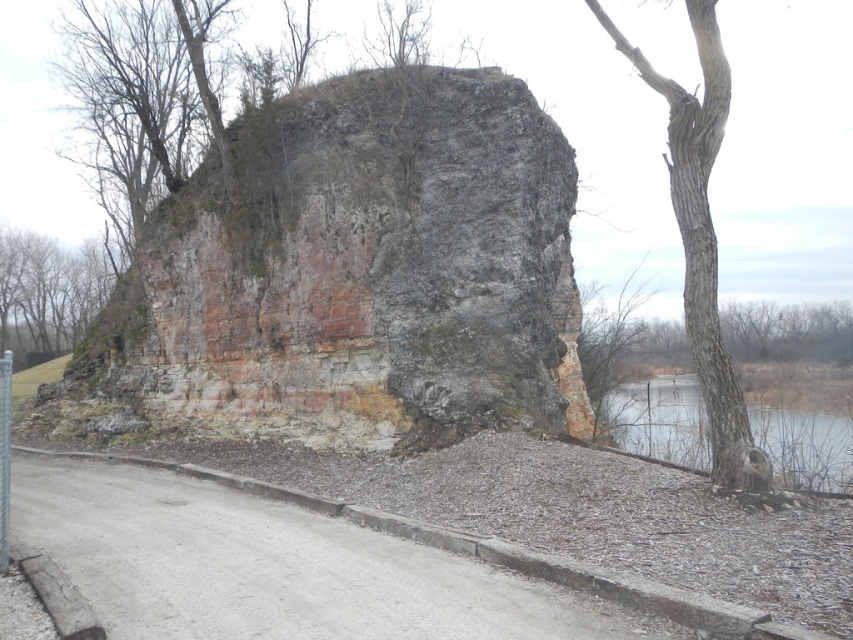
Does point (161, 244) lie in front of point (625, 339)?

That is True.

Does rusty stone cliff at center have a greater width compared to bare branches at right?

Correct, the width of rusty stone cliff at center exceeds that of bare branches at right.

Where is `rusty stone cliff at center`? rusty stone cliff at center is located at coordinates (358, 273).

Find the location of a particular element. The height and width of the screenshot is (640, 853). rusty stone cliff at center is located at coordinates (358, 273).

Does brown rough tree at left appear on the left side of bare branches at right?

Yes, brown rough tree at left is to the left of bare branches at right.

Is brown rough tree at left taller than bare branches at right?

Indeed, brown rough tree at left has a greater height compared to bare branches at right.

Who is more forward, (48, 272) or (602, 438)?

Point (602, 438)

Locate an element on the screen. brown rough tree at left is located at coordinates (48, 291).

Is the position of rusty stone cliff at center more distant than that of smooth gray bark tree at right?

Yes, rusty stone cliff at center is behind smooth gray bark tree at right.

Is rusty stone cliff at center to the right of smooth gray bark tree at right from the viewer's perspective?

In fact, rusty stone cliff at center is to the left of smooth gray bark tree at right.

Find the location of a particular element. The width and height of the screenshot is (853, 640). rusty stone cliff at center is located at coordinates (358, 273).